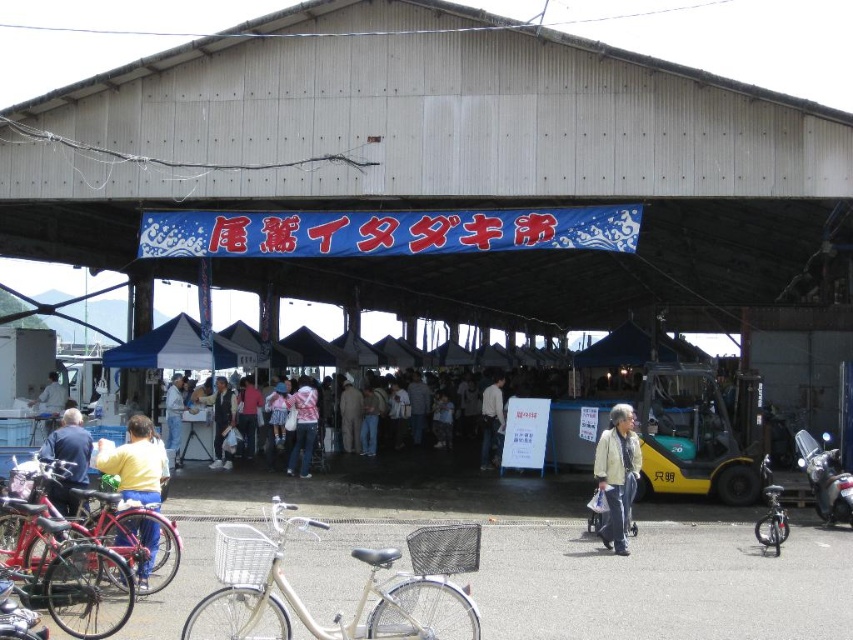
Is blue fabric canopy at center closer to the viewer compared to light blue fabric jacket at center?

Yes.

Does blue fabric canopy at center have a larger size compared to light blue fabric jacket at center?

Yes, blue fabric canopy at center is bigger than light blue fabric jacket at center.

Is point (113, 349) farther from camera compared to point (39, 401)?

No.

This screenshot has width=853, height=640. Identify the location of blue fabric canopy at center. (178, 349).

Is point (782, 528) less distant than point (210, 465)?

Yes.

Which is in front, point (763, 536) or point (213, 440)?

Positioned in front is point (763, 536).

The height and width of the screenshot is (640, 853). I want to click on black matte bicycle at lower right, so click(770, 513).

How far apart are light beige jacket at center and blue denim jacket at center?

light beige jacket at center is 6.86 meters from blue denim jacket at center.

Who is lower down, light beige jacket at center or blue denim jacket at center?

light beige jacket at center

Is point (636, 468) closer to viewer compared to point (56, 449)?

No, (636, 468) is further to viewer.

Where is `light beige jacket at center`? The width and height of the screenshot is (853, 640). light beige jacket at center is located at coordinates [x=618, y=474].